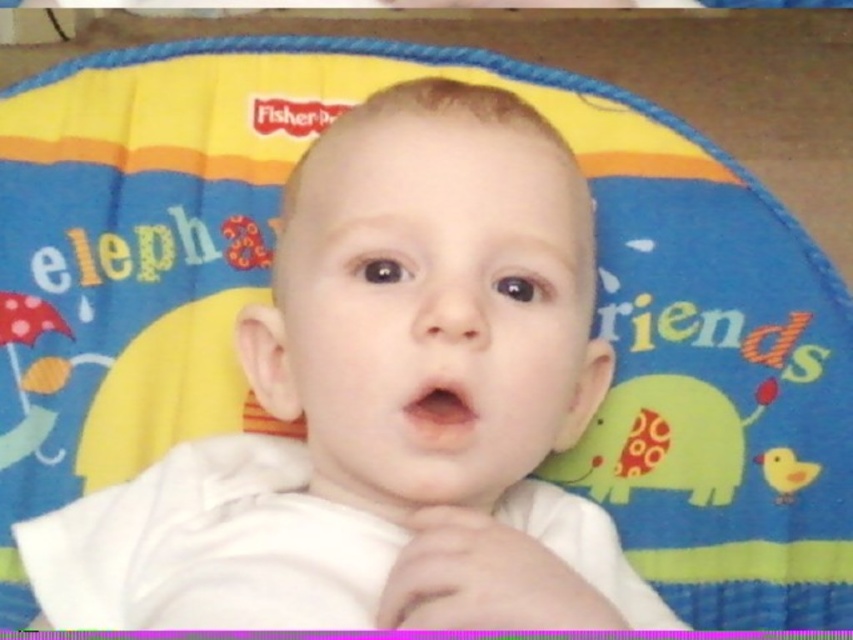
You are a photographer trying to capture a closeup of the yellow matte duckling at lower right without the white soft baby at center blocking it. Based on their sizes, which object would be easier to fully frame in your camera viewfinder?

The yellow matte duckling at lower right is smaller than the white soft baby at center, so it would be easier to fully frame in the camera viewfinder since it takes up less space.

You are a photographer taking a closeup shot of the baby. You have two points marked on your screen, point (357, 592) and point (820, 465). Which point should you focus on to ensure the baby is in focus?

You should focus on point (357, 592) because it is closer to the camera than point (820, 465), ensuring the baby is in focus.